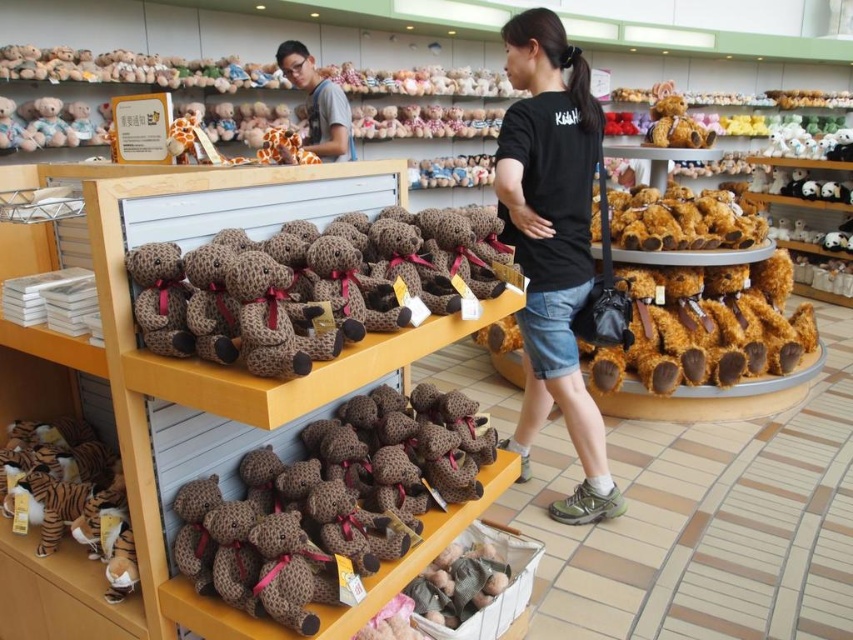
Question: Which object is the farthest from the matte gray shirt at upper center?

Choices:
 (A) black cotton t-shirt at center
 (B) leopard print plush bear at center

Answer: (B)

Question: Estimate the real-world distances between objects in this image. Which object is closer to the black cotton t-shirt at center?

Choices:
 (A) brown plush bear at center
 (B) matte gray shirt at upper center
 (C) leopard print plush bear at center

Answer: (A)

Question: Estimate the real-world distances between objects in this image. Which object is closer to the leopard print plush bear at center?

Choices:
 (A) matte gray shirt at upper center
 (B) brown plush bear at center
 (C) black cotton t-shirt at center

Answer: (B)

Question: Can you confirm if brown plush bear at center is bigger than leopard print plush bear at center?

Choices:
 (A) no
 (B) yes

Answer: (A)

Question: Does leopard print plush bear at center appear over matte gray shirt at upper center?

Choices:
 (A) no
 (B) yes

Answer: (A)

Question: Can you confirm if brown plush bear at center is wider than black cotton t-shirt at center?

Choices:
 (A) yes
 (B) no

Answer: (A)